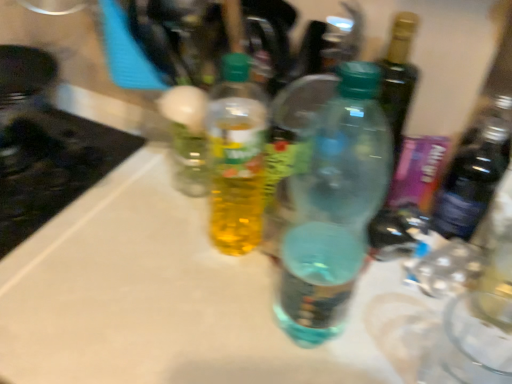
You are a GUI agent. You are given a task and a screenshot of the screen. Output one action in this format:
    pyautogui.click(x=<x>, y=<y>)
    Task: Click on the free space in front of translucent plastic bottle at center, the second bottle when ordered from right to left
    The image size is (512, 384).
    Given the screenshot: What is the action you would take?
    pyautogui.click(x=208, y=326)